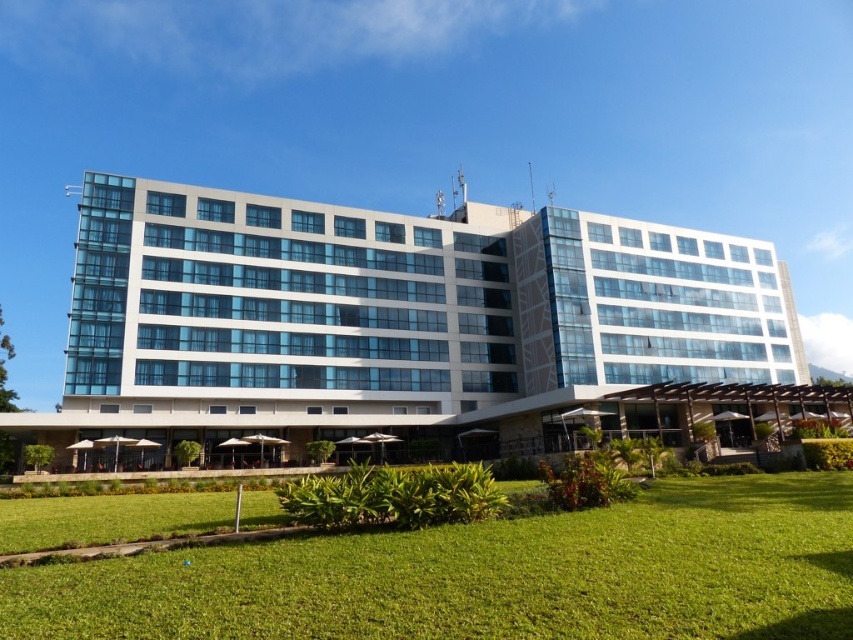
Question: Does white glass building at center appear over green grass at lower center?

Choices:
 (A) no
 (B) yes

Answer: (B)

Question: Among these points, which one is farthest from the camera?

Choices:
 (A) (321, 340)
 (B) (4, 588)

Answer: (A)

Question: Does white glass building at center have a greater width compared to green grass at lower center?

Choices:
 (A) yes
 (B) no

Answer: (A)

Question: Which object is farther from the camera taking this photo?

Choices:
 (A) green grass at lower center
 (B) white glass building at center

Answer: (B)

Question: Can you confirm if white glass building at center is positioned below green grass at lower center?

Choices:
 (A) yes
 (B) no

Answer: (B)